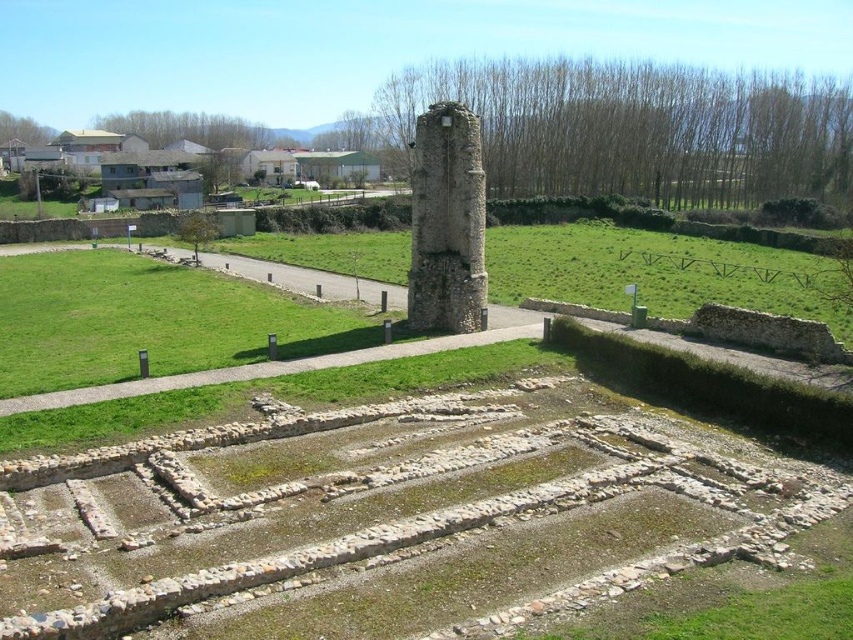
In the scene shown: You are an archaeologist examining the site. You notice the green grass at center and the weathered stone pillar at center. Which of these two objects covers a bigger area?

The green grass at center is larger in size than the weathered stone pillar at center, so the green grass at center covers a bigger area.

From the picture: You are an archaeologist examining the site and need to walk from the green grass at center to the weathered stone pillar at center. Which direction should you move to reach the pillar?

You should move to the right to reach the weathered stone pillar at center because the green grass at center is located to the left of it.